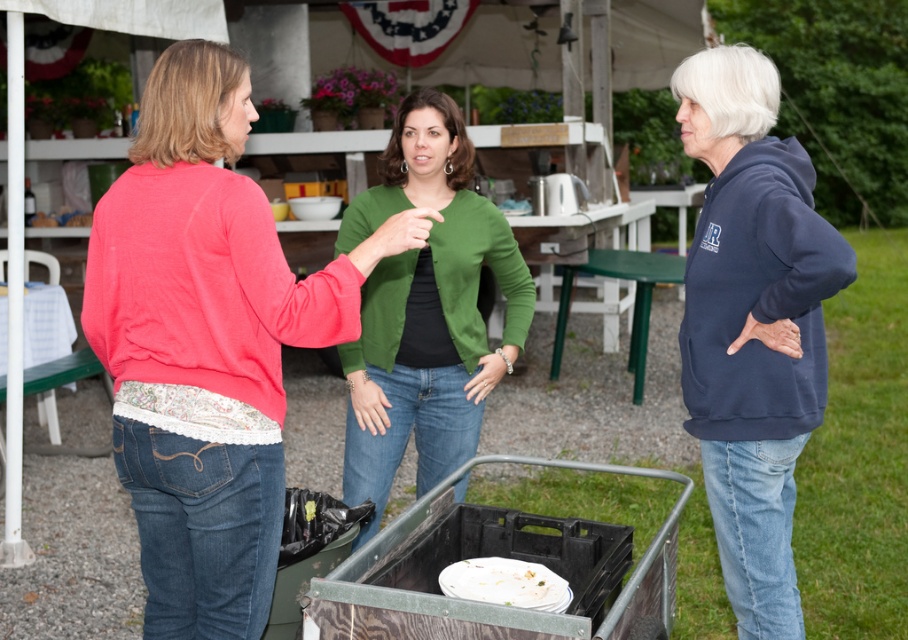
You are at a community event and see the metallic gray cart at lower center and the white matte plate at lower center. Which object is taller?

The metallic gray cart at lower center is much taller than the white matte plate at lower center.

Looking at this image, you are standing at the center of the tent and want to take a photo. There are two points marked in the image, point 1 at coordinates point (405, 612) and point 2 at coordinates point (441, 580). Which point should you focus on to ensure it appears larger in your photo?

Point 1 at coordinates point (405, 612) is closer to the camera, so it will appear larger in the photo.